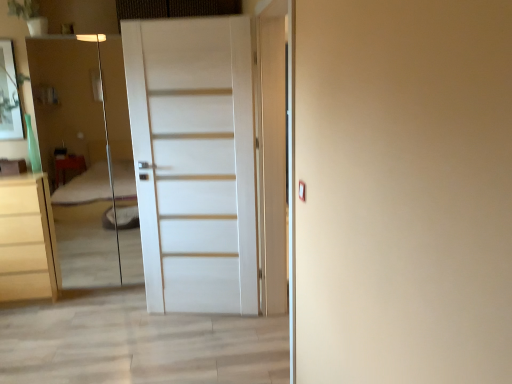
Question: Is white matte door at center facing towards transparent glass elevator at left?

Choices:
 (A) no
 (B) yes

Answer: (A)

Question: Is transparent glass elevator at left at the back of white matte door at center?

Choices:
 (A) yes
 (B) no

Answer: (B)

Question: Does white matte door at center have a greater width compared to transparent glass elevator at left?

Choices:
 (A) yes
 (B) no

Answer: (B)

Question: From the image's perspective, is white matte door at center under transparent glass elevator at left?

Choices:
 (A) yes
 (B) no

Answer: (A)

Question: From a real-world perspective, is white matte door at center located beneath transparent glass elevator at left?

Choices:
 (A) no
 (B) yes

Answer: (A)

Question: Are white matte door at center and transparent glass elevator at left making contact?

Choices:
 (A) yes
 (B) no

Answer: (B)

Question: Is transparent glass elevator at left wider than matte white chest of drawers at left?

Choices:
 (A) no
 (B) yes

Answer: (A)

Question: Is transparent glass elevator at left positioned behind matte white chest of drawers at left?

Choices:
 (A) yes
 (B) no

Answer: (B)

Question: Is transparent glass elevator at left oriented towards matte white chest of drawers at left?

Choices:
 (A) yes
 (B) no

Answer: (B)

Question: Is transparent glass elevator at left to the left of matte white chest of drawers at left from the viewer's perspective?

Choices:
 (A) yes
 (B) no

Answer: (B)

Question: Considering the relative sizes of transparent glass elevator at left and matte white chest of drawers at left in the image provided, is transparent glass elevator at left taller than matte white chest of drawers at left?

Choices:
 (A) no
 (B) yes

Answer: (B)

Question: Considering the relative sizes of transparent glass elevator at left and matte white chest of drawers at left in the image provided, is transparent glass elevator at left smaller than matte white chest of drawers at left?

Choices:
 (A) yes
 (B) no

Answer: (B)

Question: Is transparent glass elevator at left surrounding white matte door at center?

Choices:
 (A) no
 (B) yes

Answer: (A)